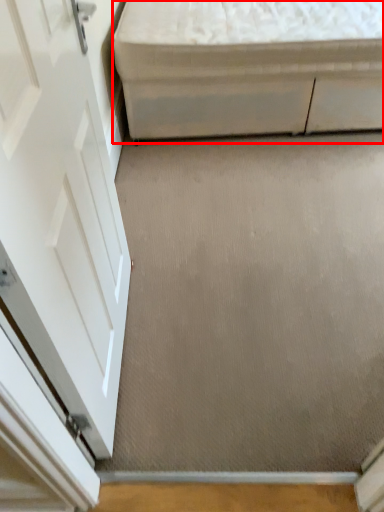
Question: From the image's perspective, what is the correct spatial positioning of furniture (annotated by the red box) in reference to concrete?

Choices:
 (A) above
 (B) below

Answer: (A)